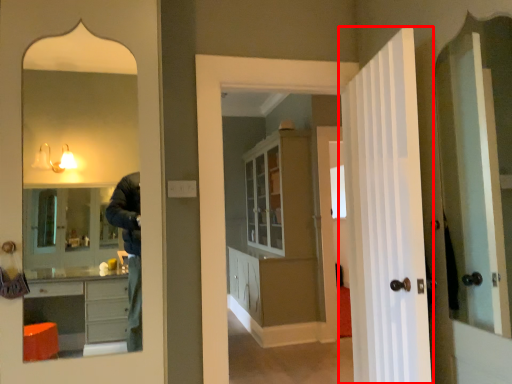
Question: From the image's perspective, where is door (annotated by the red box) located in relation to dresser in the image?

Choices:
 (A) below
 (B) above

Answer: (B)